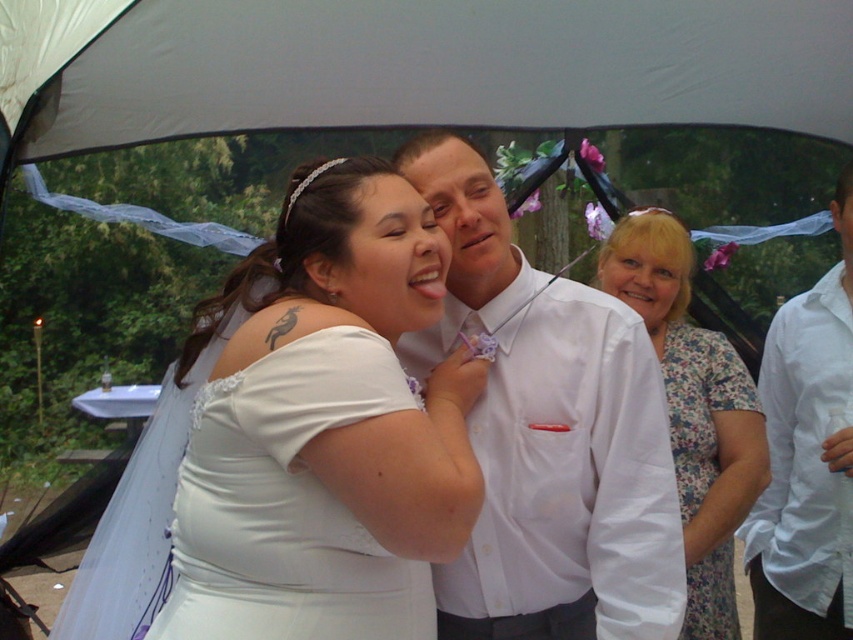
You are a photographer at a wedding event. You need to position yourself to capture a photo of the white glossy shirt at center and the floral dress at center. Which one is positioned to the left side of the other?

The white glossy shirt at center is positioned to the left of the floral dress at center.

You are a photographer at a wedding event. You need to capture a photo of the white fabric canopy at upper center and the white satin dress at center. Which object is wider in the image?

The white fabric canopy at upper center is wider than the white satin dress at center according to the description.